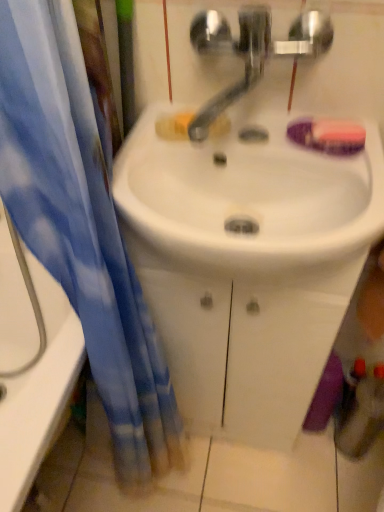
Identify the location of vacant area situated to the left side of purple matte soap at upper right. Image resolution: width=384 pixels, height=512 pixels. (235, 142).